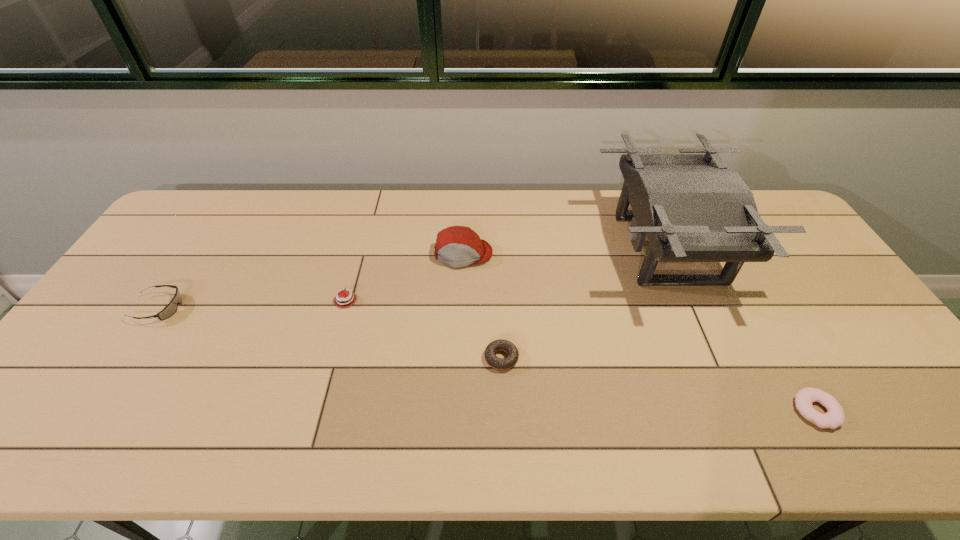
What are the coordinates of `vacant space at the far edge of the desktop` in the screenshot? It's located at (535, 209).

Identify the location of free spot at the near edge of the desktop. (428, 430).

This screenshot has width=960, height=540. Find the location of `free region at the left edge of the desktop`. free region at the left edge of the desktop is located at coordinates (159, 244).

This screenshot has width=960, height=540. In the image, there is a desktop. Identify the location of free space at the right edge. coord(795,280).

What are the coordinates of `vacant area between the shorter doughnut and the farther doughnut` in the screenshot? It's located at (659, 384).

Image resolution: width=960 pixels, height=540 pixels. I want to click on free space between the leftmost object and the left doughnut, so click(x=330, y=333).

The width and height of the screenshot is (960, 540). Find the location of `empty space between the cap and the drone`. empty space between the cap and the drone is located at coordinates (565, 252).

Find the location of a particular element. free space between the tallest object and the shortest object is located at coordinates (741, 330).

The width and height of the screenshot is (960, 540). Identify the location of unoccupied position between the second tallest object and the second nearest object. (482, 306).

Find the location of a particular element. The height and width of the screenshot is (540, 960). vacant space in between the tallest object and the fifth shortest object is located at coordinates (565, 252).